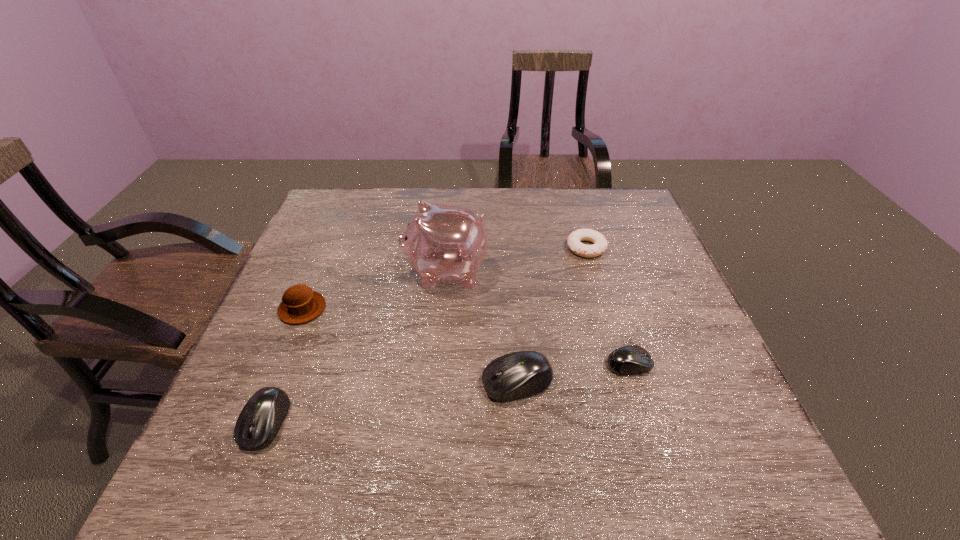
At what (x,y) coordinates should I click in order to perform the action: click on the leftmost mouse. Please return your answer as a coordinate pair (x, y). The height and width of the screenshot is (540, 960). Looking at the image, I should click on (260, 420).

The height and width of the screenshot is (540, 960). Identify the location of the fourth tallest object. (260, 420).

Where is `the second mouse from right to left`? This screenshot has height=540, width=960. the second mouse from right to left is located at coordinates (521, 374).

The height and width of the screenshot is (540, 960). In order to click on the shortest mouse in this screenshot , I will do `click(628, 360)`.

Where is `the shortest object`? This screenshot has height=540, width=960. the shortest object is located at coordinates (599, 241).

In order to click on muffin in this screenshot , I will do `click(300, 304)`.

You are a GUI agent. You are given a task and a screenshot of the screen. Output one action in this format:
    pyautogui.click(x=<x>, y=<y>)
    Task: Click on the piggy bank
    This screenshot has width=960, height=540.
    Given the screenshot: What is the action you would take?
    pyautogui.click(x=442, y=243)

The height and width of the screenshot is (540, 960). I want to click on free space located on the right of the leftmost mouse, so click(466, 422).

Identify the location of vacant space located on the back of the second mouse from left to right. This screenshot has height=540, width=960. (508, 262).

Locate an element on the screen. vacant area situated on the back of the shortest mouse is located at coordinates (594, 250).